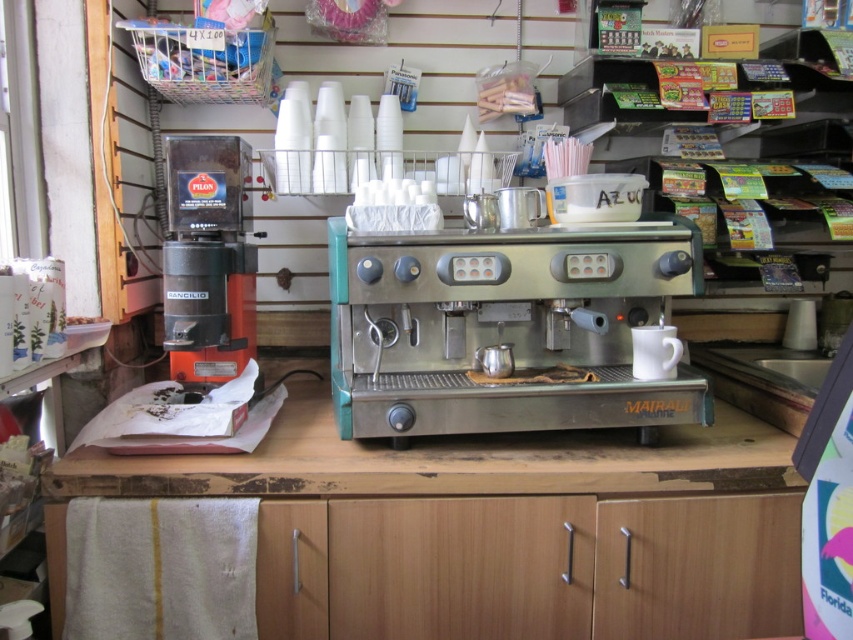
Question: Among these points, which one is nearest to the camera?

Choices:
 (A) (599, 486)
 (B) (228, 314)
 (C) (622, 404)

Answer: (A)

Question: Which object is positioned closest to the orange matte coffee machine at left?

Choices:
 (A) stainless steel espresso machine at center
 (B) wooden at center

Answer: (B)

Question: Which object is the farthest from the stainless steel espresso machine at center?

Choices:
 (A) orange matte coffee machine at left
 (B) wooden at center

Answer: (A)

Question: Is wooden at center to the right of orange matte coffee machine at left from the viewer's perspective?

Choices:
 (A) yes
 (B) no

Answer: (A)

Question: In this image, where is stainless steel espresso machine at center located relative to wooden at center?

Choices:
 (A) below
 (B) above

Answer: (B)

Question: Is stainless steel espresso machine at center to the right of orange matte coffee machine at left from the viewer's perspective?

Choices:
 (A) no
 (B) yes

Answer: (B)